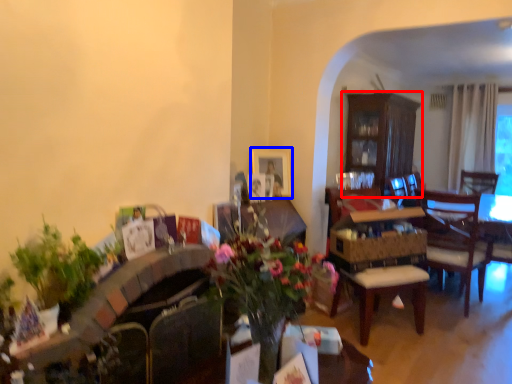
Question: Which object appears closest to the camera in this image, cabinetry (highlighted by a red box) or picture frame (highlighted by a blue box)?

Choices:
 (A) cabinetry
 (B) picture frame

Answer: (B)